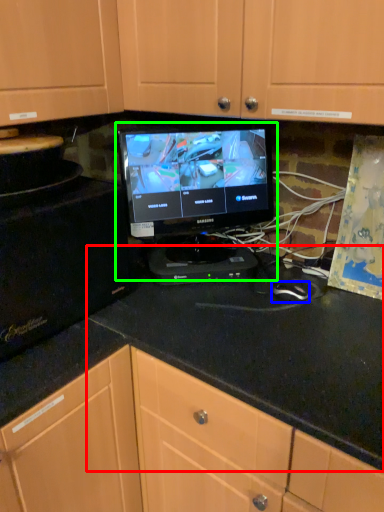
Question: Estimate the real-world distances between objects in this image. Which object is closer to counter top (highlighted by a red box), mouse (highlighted by a blue box) or computer monitor (highlighted by a green box)?

Choices:
 (A) mouse
 (B) computer monitor

Answer: (A)